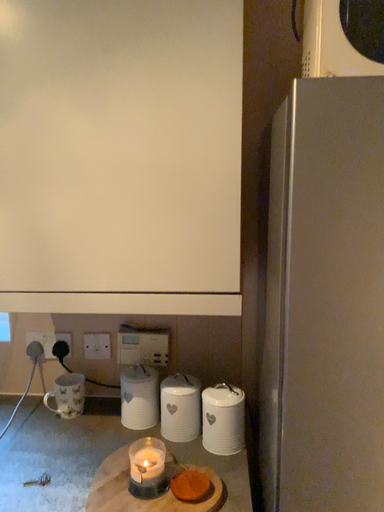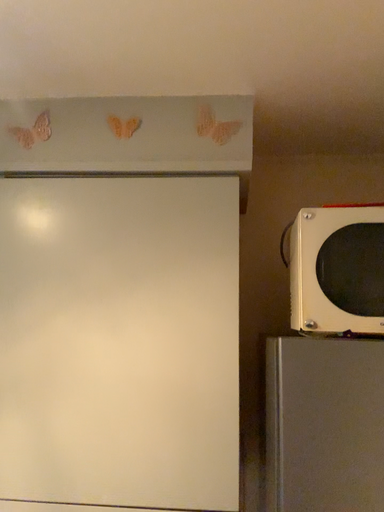
Question: Which way did the camera rotate in the video?

Choices:
 (A) rotated upward
 (B) rotated downward

Answer: (A)